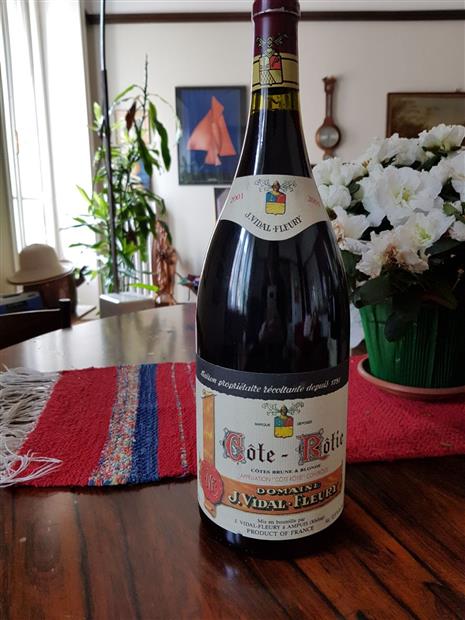
Locate an element on the screen. blue background of painting is located at coordinates (198, 110).